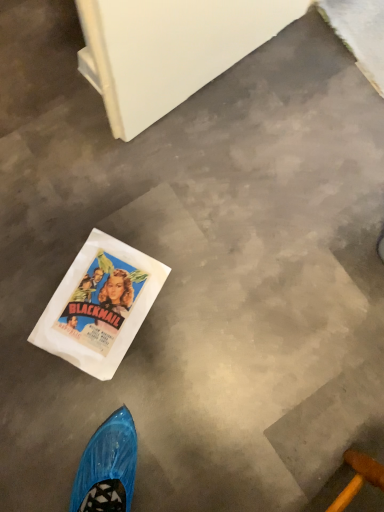
Locate an element on the screen. The width and height of the screenshot is (384, 512). free spot below white paper comic book at lower left (from a real-world perspective) is located at coordinates (76, 318).